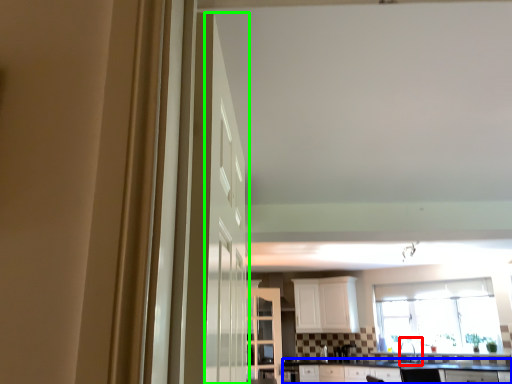
Question: Which object is positioned farthest from sink (highlighted by a red box)? Select from countertop (highlighted by a blue box) and door (highlighted by a green box).

Choices:
 (A) countertop
 (B) door

Answer: (B)